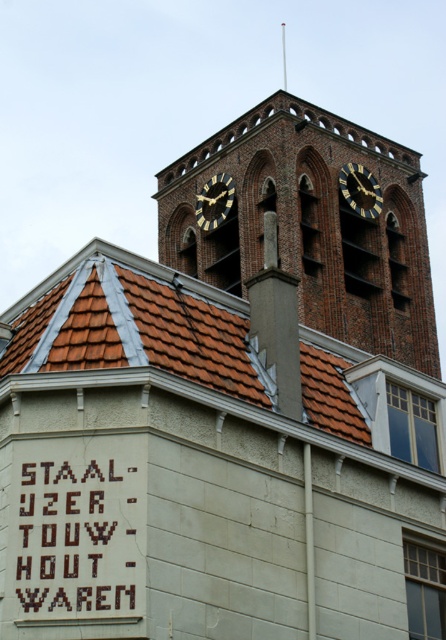
Question: Which of these objects is positioned closest to the goldmetallicclock tower at upper center?

Choices:
 (A) brown wooden sign at lower left
 (B) brown tile roof at upper center

Answer: (B)

Question: Can you confirm if brick clock tower at upper center is smaller than goldmetallicclock tower at upper center?

Choices:
 (A) no
 (B) yes

Answer: (A)

Question: Considering the real-world distances, which object is closest to the brown tile roof at upper center?

Choices:
 (A) goldmetallicclock at upper center
 (B) brick clock tower at upper center
 (C) goldmetallicclock tower at upper center
 (D) brown wooden sign at lower left

Answer: (D)

Question: Where is brick clock tower at upper center located in relation to goldmetallicclock tower at upper center in the image?

Choices:
 (A) above
 (B) below

Answer: (B)

Question: Does brown tile roof at upper center appear under goldmetallicclock tower at upper center?

Choices:
 (A) no
 (B) yes

Answer: (B)

Question: Which point is closer to the camera taking this photo?

Choices:
 (A) pyautogui.click(x=356, y=250)
 (B) pyautogui.click(x=346, y=419)
 (C) pyautogui.click(x=356, y=177)

Answer: (B)